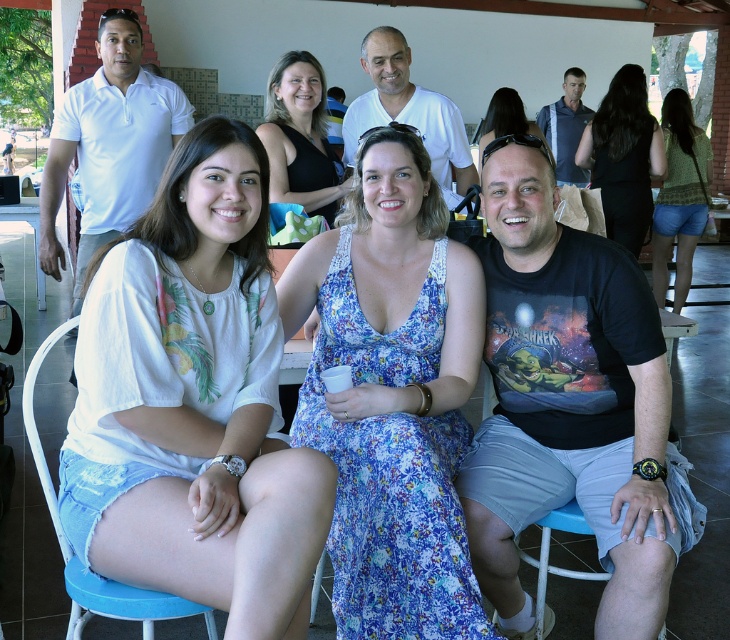
You are taking a photo of the people in the scene. The white cotton shirt at center and the black dress at center are both in the frame. Which one is closer to the camera?

The white cotton shirt at center is in front of the black dress at center, so it is closer to the camera.

You are taking a photo of the three people sitting on the white metal chairs. The camera is set to focus on the person at the center. Will the floral fabric dress at center be in focus?

The floral fabric dress at center is located at point (391, 396), which is the center of the image. Since the camera is focused on the center person, the floral fabric dress at center will be in focus.

You are a photographer adjusting your camera settings. You notice the white cotton shirt at center and the matte black sunglasses at upper center in your viewfinder. Which object appears taller in the frame?

The white cotton shirt at center appears taller than the matte black sunglasses at upper center in the viewfinder.